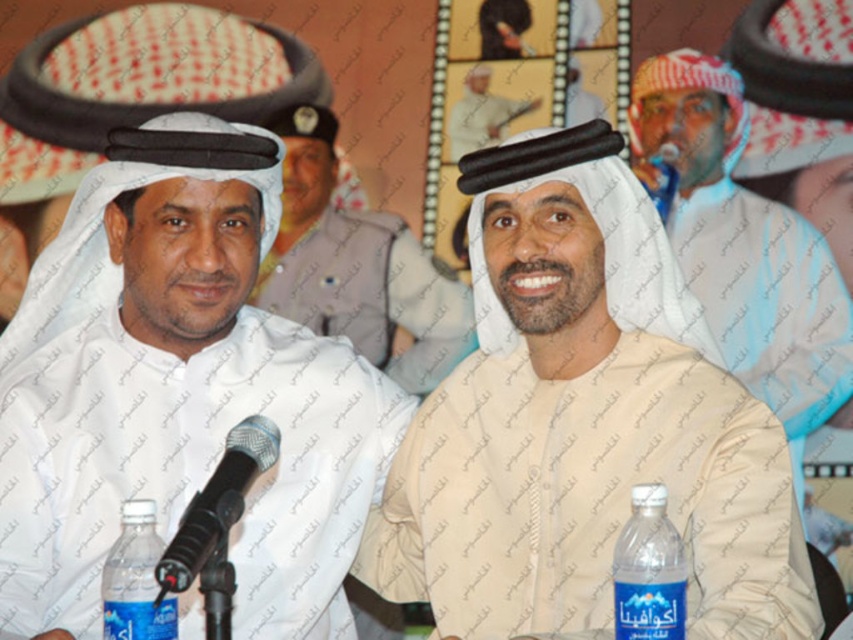
You are a photographer adjusting your camera settings. You need to focus on two points in the image labeled as point (582,449) and point (183,380). Which point should you adjust your focus for first if you want to capture the closest point to the camera?

Point (582,449) is closer to the camera than point (183,380), so you should focus on point (582,449) first.